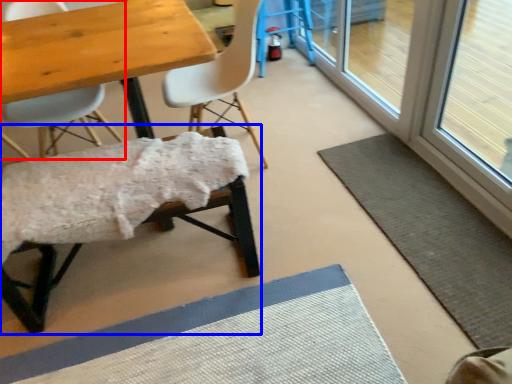
Question: Which object appears closest to the camera in this image, chair (highlighted by a red box) or chair (highlighted by a blue box)?

Choices:
 (A) chair
 (B) chair

Answer: (B)